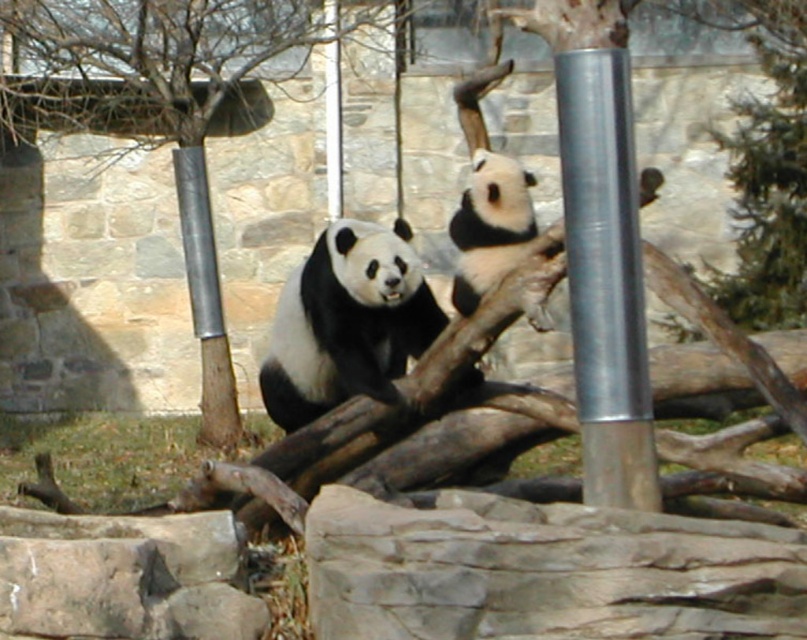
You are a zookeeper planning to place a new feeding station between the green textured tree at upper right and the silver metallic pole at center. Based on their positions, which object is closer to the ground and should the feeding station be placed below it to avoid obstruction?

The silver metallic pole at center is closer to the ground since the green textured tree at upper right is positioned over it. Therefore, the feeding station should be placed below the green textured tree at upper right to avoid blocking the pole.